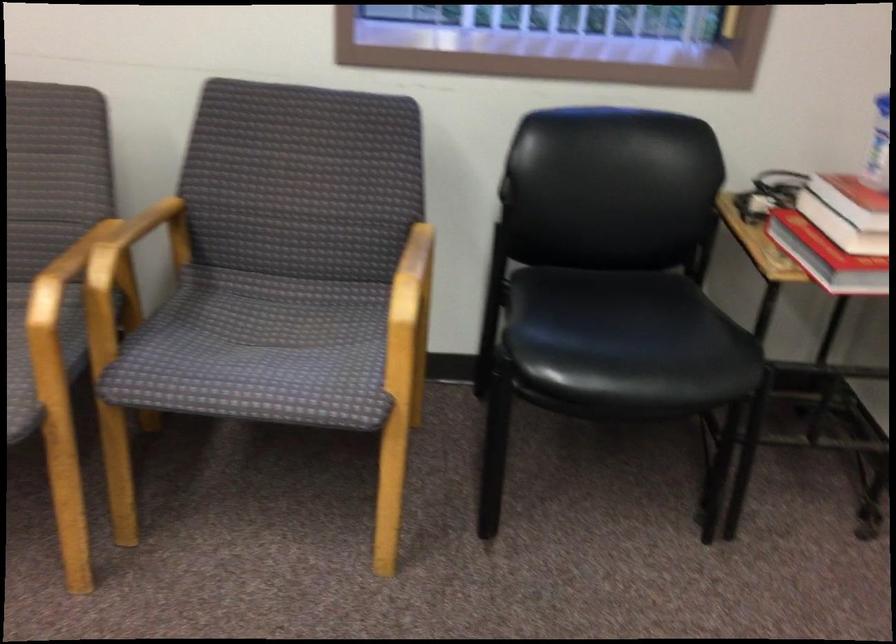
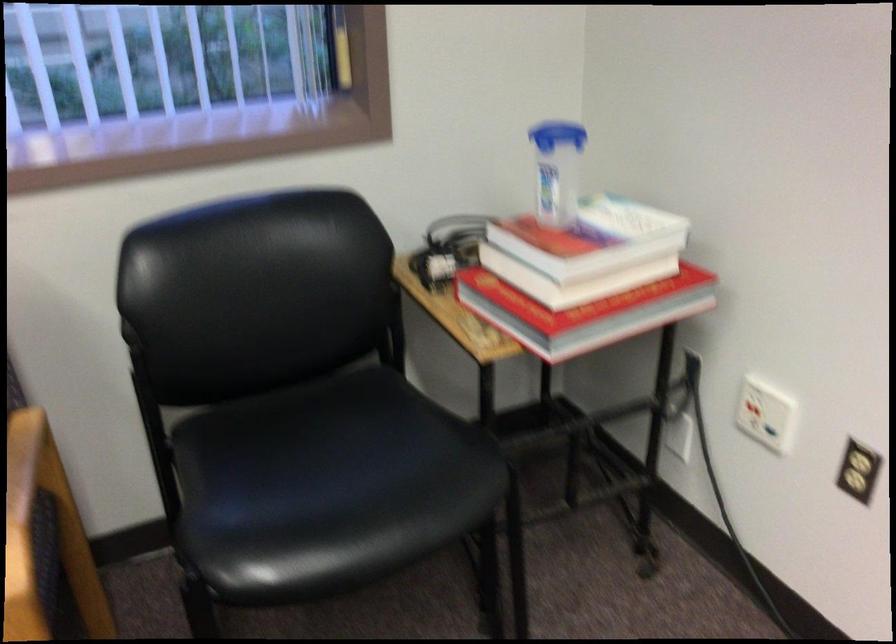
Find the pixel in the second image that matches (490,279) in the first image.

(151, 421)